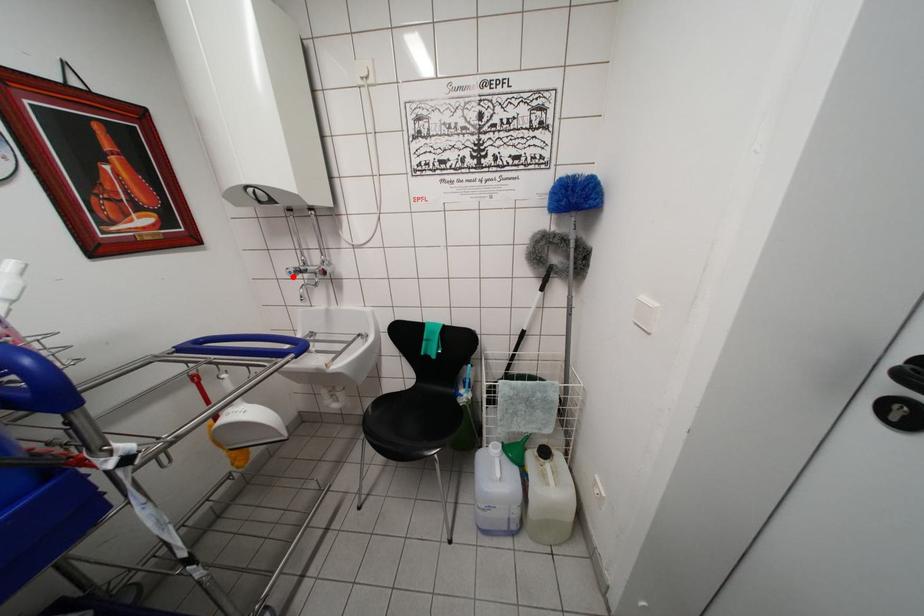
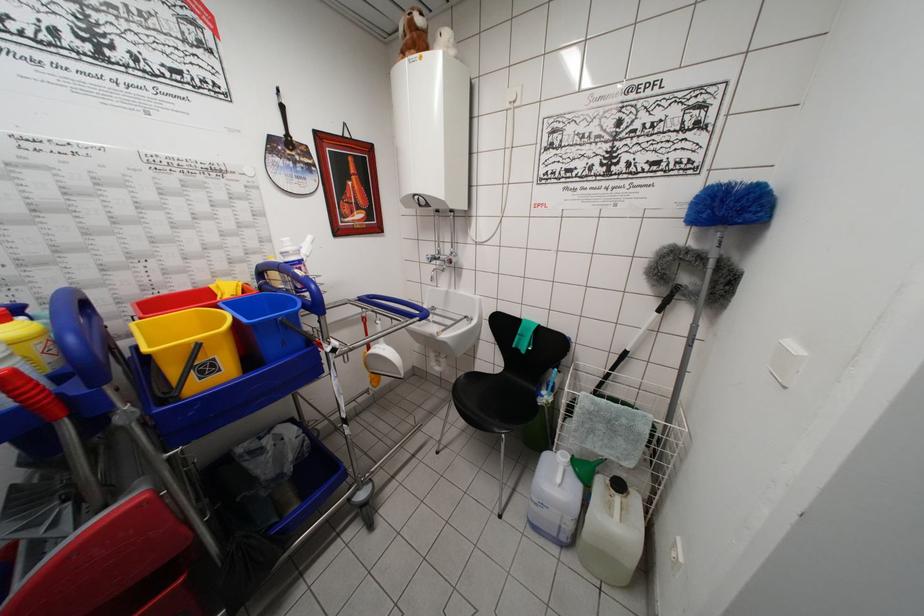
The point at the highlighted location is marked in the first image. Where is the corresponding point in the second image?

(432, 262)